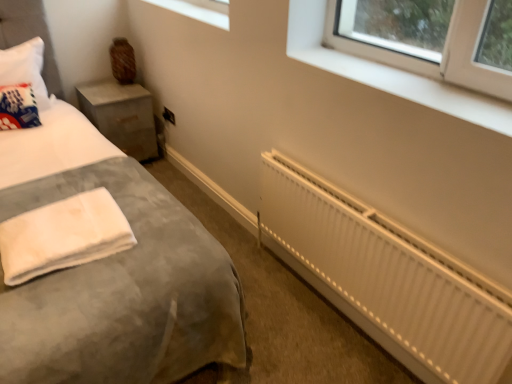
Question: From a real-world perspective, is white fluffy towel at lower left positioned over velvet grey bed at lower left based on gravity?

Choices:
 (A) yes
 (B) no

Answer: (B)

Question: Is white fluffy towel at lower left not within velvet grey bed at lower left?

Choices:
 (A) yes
 (B) no

Answer: (B)

Question: Does white fluffy towel at lower left have a larger size compared to velvet grey bed at lower left?

Choices:
 (A) yes
 (B) no

Answer: (B)

Question: Is white fluffy towel at lower left next to velvet grey bed at lower left and touching it?

Choices:
 (A) yes
 (B) no

Answer: (B)

Question: Considering the relative positions of white fluffy towel at lower left and velvet grey bed at lower left in the image provided, is white fluffy towel at lower left to the left of velvet grey bed at lower left from the viewer's perspective?

Choices:
 (A) no
 (B) yes

Answer: (A)

Question: Based on their sizes in the image, would you say white fluffy towel at lower left is bigger or smaller than white metallic radiator at lower right?

Choices:
 (A) big
 (B) small

Answer: (B)

Question: From the image's perspective, relative to white metallic radiator at lower right, is white fluffy towel at lower left above or below?

Choices:
 (A) above
 (B) below

Answer: (A)

Question: Looking at their shapes, would you say white fluffy towel at lower left is wider or thinner than white metallic radiator at lower right?

Choices:
 (A) wide
 (B) thin

Answer: (A)

Question: Is white fluffy towel at lower left taller or shorter than white metallic radiator at lower right?

Choices:
 (A) short
 (B) tall

Answer: (A)

Question: Is translucent glass window at upper center, which appears as the 1th window when viewed from the left, taller or shorter than concrete textured nightstand at left?

Choices:
 (A) tall
 (B) short

Answer: (B)

Question: From a real-world perspective, is translucent glass window at upper center, which is counted as the first window, starting from the back, above or below concrete textured nightstand at left?

Choices:
 (A) above
 (B) below

Answer: (A)

Question: Is translucent glass window at upper center, the second window when ordered from right to left, in front of or behind concrete textured nightstand at left in the image?

Choices:
 (A) front
 (B) behind

Answer: (A)

Question: Visually, is translucent glass window at upper center, which is counted as the first window, starting from the back, positioned to the left or to the right of concrete textured nightstand at left?

Choices:
 (A) left
 (B) right

Answer: (B)

Question: From a real-world perspective, is translucent glass window at upper center, marked as the 2th window in a front-to-back arrangement, positioned above or below white plastic window at upper right, which is counted as the first window, starting from the right?

Choices:
 (A) below
 (B) above

Answer: (B)

Question: Looking at the image, does translucent glass window at upper center, which is counted as the first window, starting from the back, seem bigger or smaller compared to white plastic window at upper right, the second window positioned from the back?

Choices:
 (A) small
 (B) big

Answer: (B)